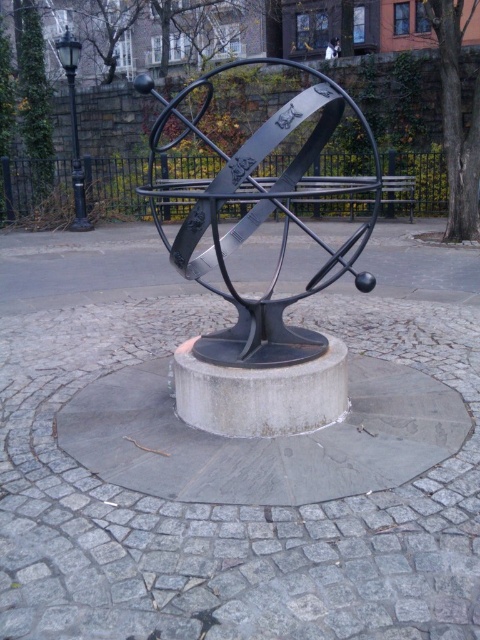
You are planning to place a new decorative item between the black metal sculpture at center and the metallic park bench at center. Considering their widths, which object should you position closer to the narrower one to ensure proper spacing?

The metallic park bench at center is narrower than the black metal sculpture at center. Position the new decorative item closer to the metallic park bench at center to maintain appropriate spacing between the two objects.

You are standing in front of the metal sculpture and want to determine the relative positions of two points on the sculpture. The points are labeled as point 1 at coordinates point (x=264, y=323) and point 2 at coordinates point (x=350, y=212). Which point is closer to you?

Point (x=264, y=323) is closer to the viewer than point (x=350, y=212).